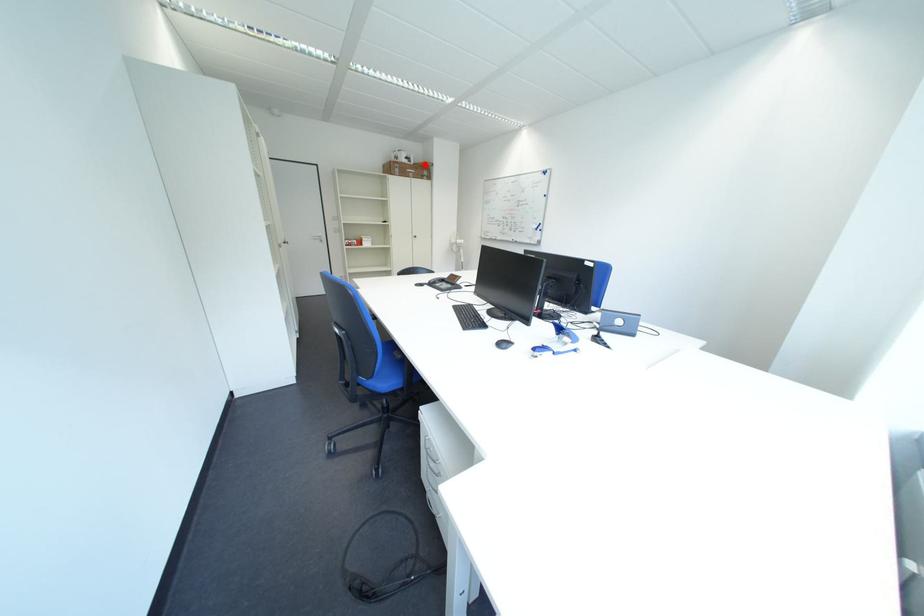
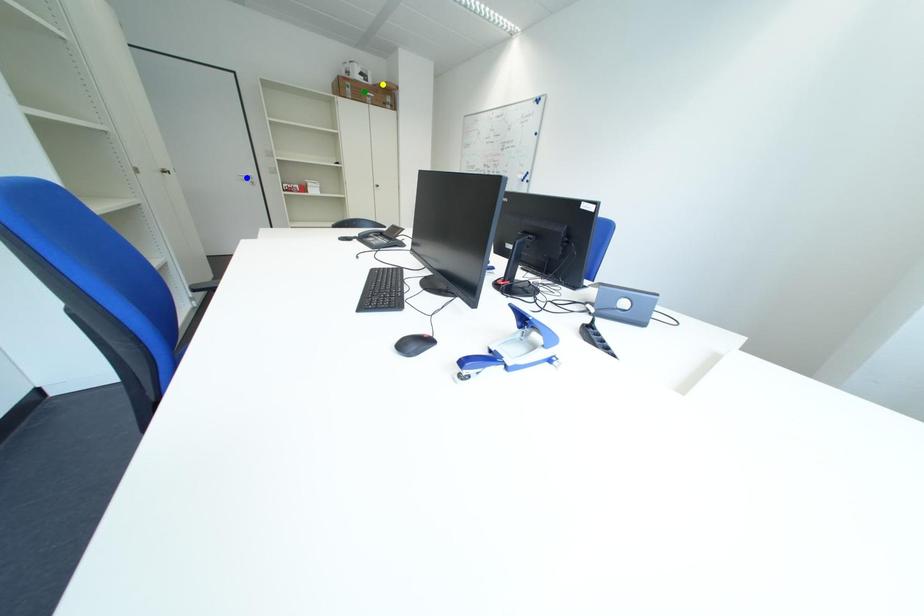
Question: I am providing you with two images of the same scene from different viewpoints. A red point is marked on the first image. You are given multiple points on the second image. Which point in image 2 represents the same 3d spot as the red point in image 1?

Choices:
 (A) green point
 (B) blue point
 (C) yellow point

Answer: (C)